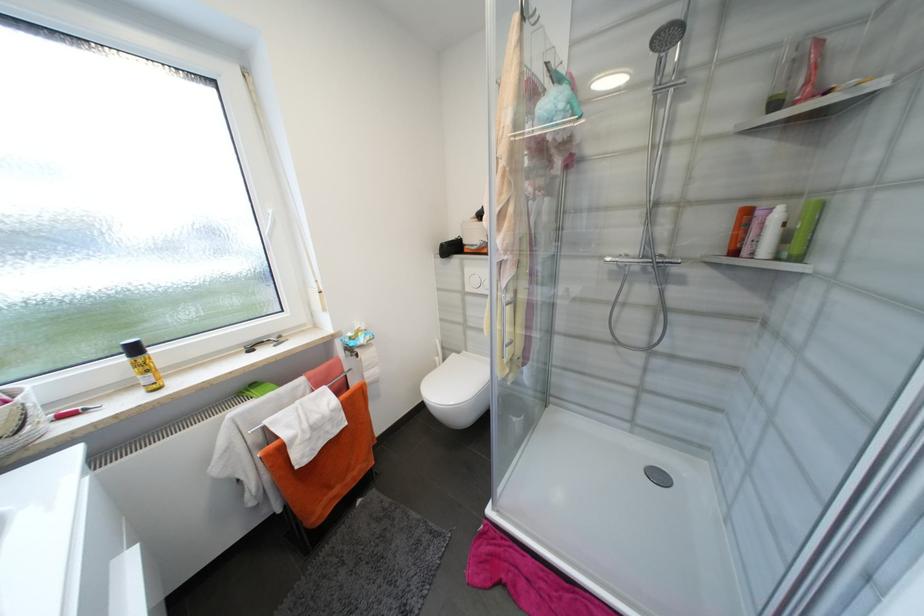
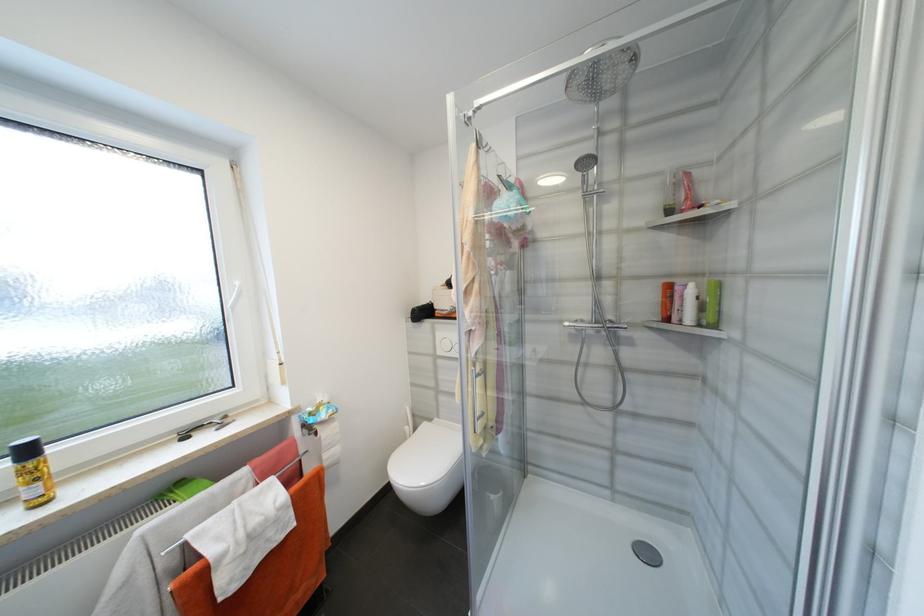
The point at (812, 84) is marked in the first image. Where is the corresponding point in the second image?

(691, 200)